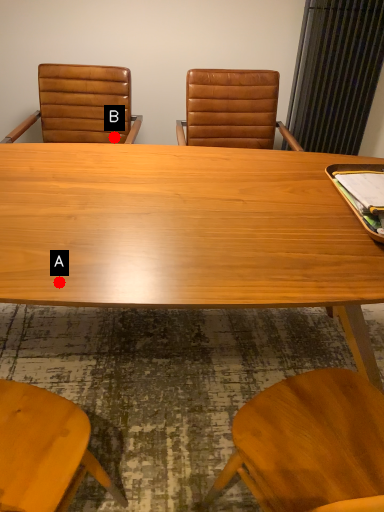
Question: Two points are circled on the image, labeled by A and B beside each circle. Among these points, which one is nearest to the camera?

Choices:
 (A) A is closer
 (B) B is closer

Answer: (A)